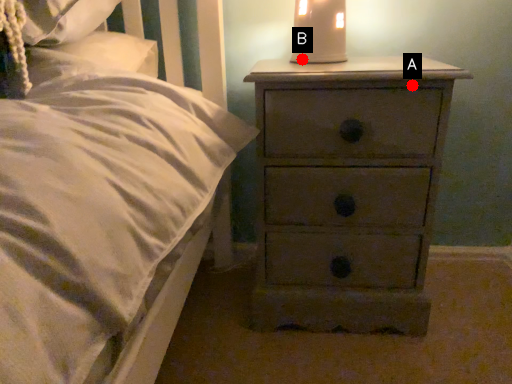
Question: Two points are circled on the image, labeled by A and B beside each circle. Which of the following is the farthest from the observer?

Choices:
 (A) A is further
 (B) B is further

Answer: (B)